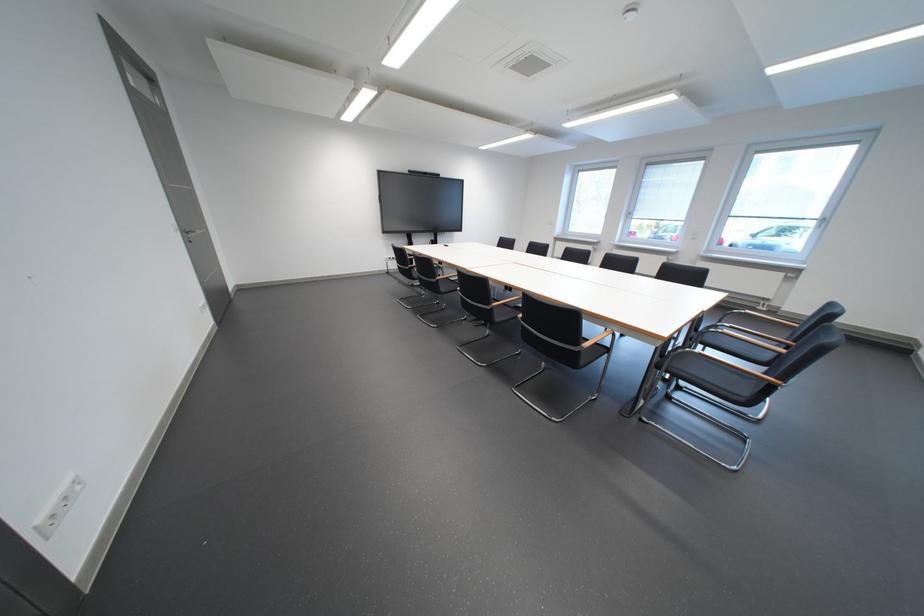
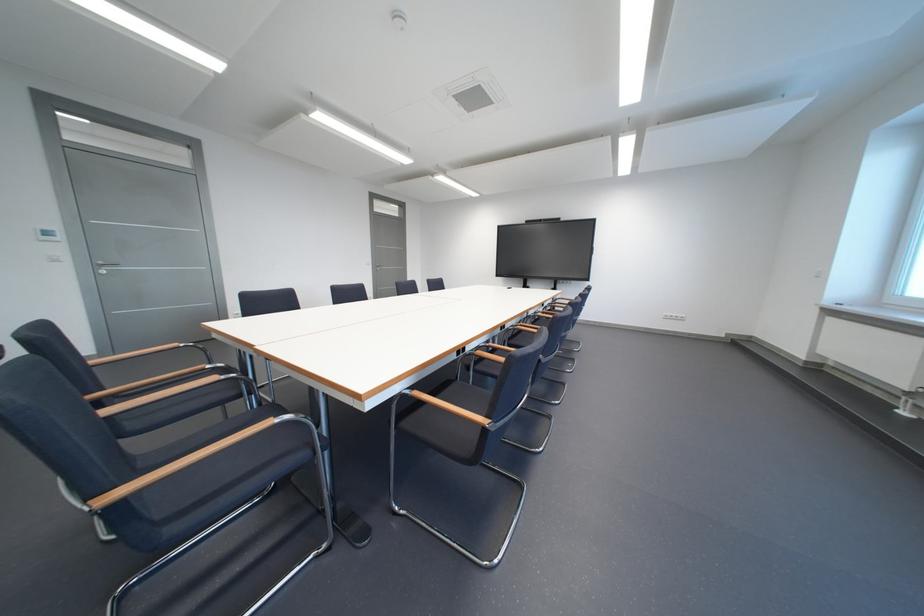
Question: I am providing you with two images of the same scene from different viewpoints. After the viewpoint changes to image2, which objects are now occluded?

Choices:
 (A) white light switch
 (B) chair sitting surface
 (C) black radiator knob
 (D) black chair sitting surface

Answer: (D)